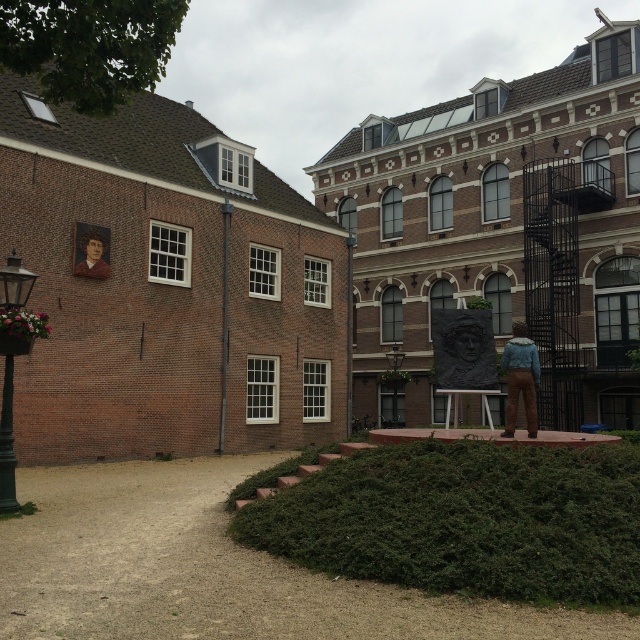
You are a delivery person trying to park your 1.2 meter wide delivery cart between the green painted metal streetlamp at left and the blue denim jacket at lower right. Can you fit your cart there?

The green painted metal streetlamp at left is thinner than the blue denim jacket at lower right, but the description does not provide the distance between them. Without knowing the actual space between the two objects, it is impossible to determine if the cart will fit.

You are a delivery person who needs to place a package between the brown brick pole at center and the smooth brown portrait at upper left. The package requires a space of 7 meters. Can you fit it between them?

The distance between the brown brick pole at center and the smooth brown portrait at upper left is 6.83 meters, which is slightly less than the required 7 meters. Therefore, the package cannot be placed between them as there isn

You are standing at the point marked by coordinates point (90, 252) in the image. Looking around, you can see the two buildings described. Which direction should you face to look towards the smaller building?

The point (90, 252) marks the smooth brown portrait at upper left. Since the smaller building is the one on the left side, you should face towards the left to look towards the smaller building.